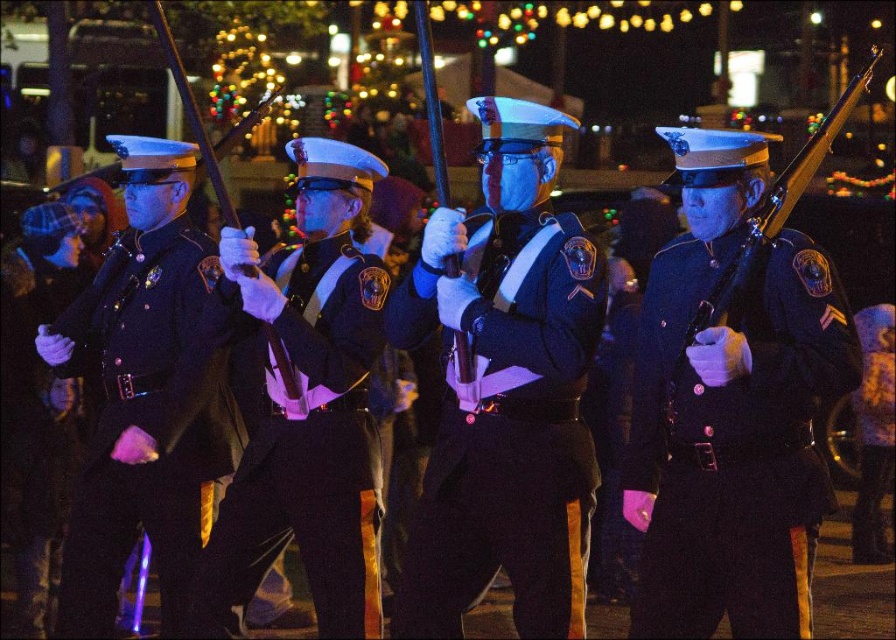
Can you confirm if dark blue fabric uniform at right is positioned below dark blue fabric uniform at left?

Actually, dark blue fabric uniform at right is above dark blue fabric uniform at left.

Can you confirm if dark blue fabric uniform at right is bigger than dark blue fabric uniform at left?

No, dark blue fabric uniform at right is not bigger than dark blue fabric uniform at left.

This screenshot has width=896, height=640. Find the location of `dark blue fabric uniform at right`. dark blue fabric uniform at right is located at coordinates (731, 438).

What do you see at coordinates (731, 438) in the screenshot? I see `dark blue fabric uniform at right` at bounding box center [731, 438].

Where is `dark blue fabric uniform at right`? dark blue fabric uniform at right is located at coordinates (731, 438).

Image resolution: width=896 pixels, height=640 pixels. Find the location of `dark blue fabric uniform at right`. dark blue fabric uniform at right is located at coordinates (731, 438).

Identify the location of dark blue fabric uniform at right. (731, 438).

Which is more to the right, matte black uniform at left or wooden rifle at right?

wooden rifle at right is more to the right.

Locate an element on the screen. This screenshot has height=640, width=896. matte black uniform at left is located at coordinates (35, 426).

Find the location of a particular element. matte black uniform at left is located at coordinates (35, 426).